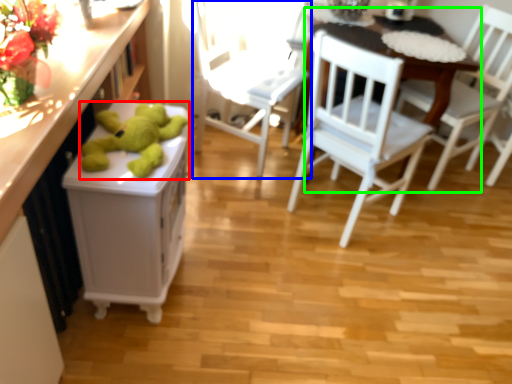
Question: Which object is the closest to the toy (highlighted by a red box)? Choose among these: chair (highlighted by a blue box) or table (highlighted by a green box).

Choices:
 (A) chair
 (B) table

Answer: (A)